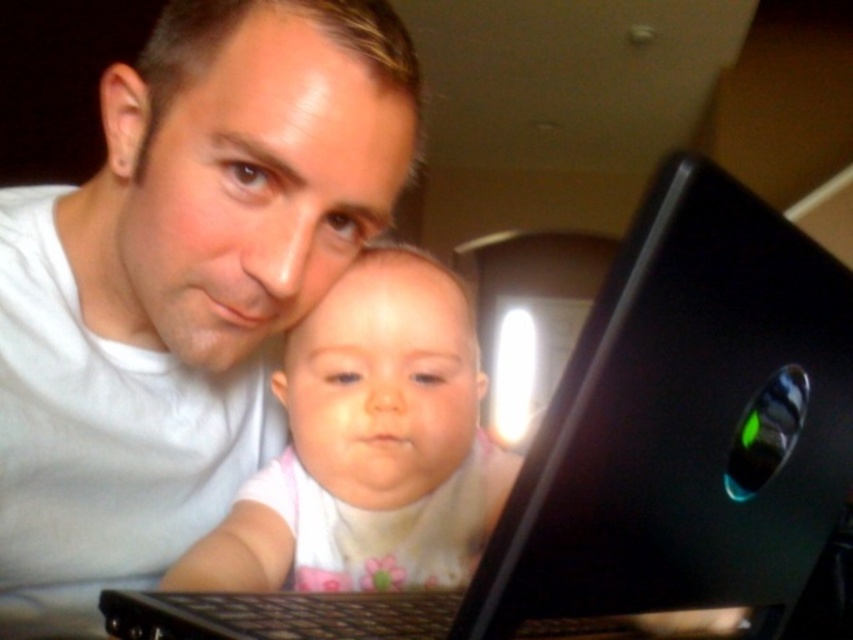
Based on the photo, who is higher up, white matte shirt at center or smooth white baby at center?

white matte shirt at center

This screenshot has height=640, width=853. What do you see at coordinates (183, 282) in the screenshot? I see `white matte shirt at center` at bounding box center [183, 282].

Who is more distant from viewer, [225,49] or [366,316]?

The point [366,316] is more distant.

Locate an element on the screen. The image size is (853, 640). white matte shirt at center is located at coordinates (183, 282).

Is point (218, 198) more distant than point (813, 401)?

Yes.

Between white matte shirt at center and black glossy laptop at center, which one appears on the right side from the viewer's perspective?

black glossy laptop at center

Which is in front, point (4, 449) or point (828, 458)?

Positioned in front is point (828, 458).

I want to click on white matte shirt at center, so [183, 282].

This screenshot has height=640, width=853. Describe the element at coordinates (645, 454) in the screenshot. I see `black glossy laptop at center` at that location.

In the scene shown: Is black glossy laptop at center thinner than smooth white baby at center?

No.

What are the coordinates of `black glossy laptop at center` in the screenshot? It's located at (645, 454).

In order to click on black glossy laptop at center in this screenshot , I will do `click(645, 454)`.